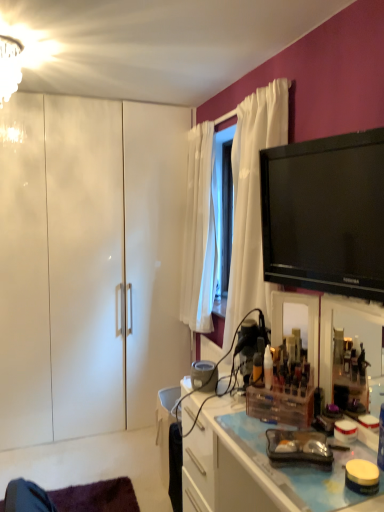
This screenshot has width=384, height=512. In order to click on vacant point above clear plastic organizer at center, the first cabinetry when ordered from front to back (from a real-world perspective) in this screenshot , I will do `click(290, 430)`.